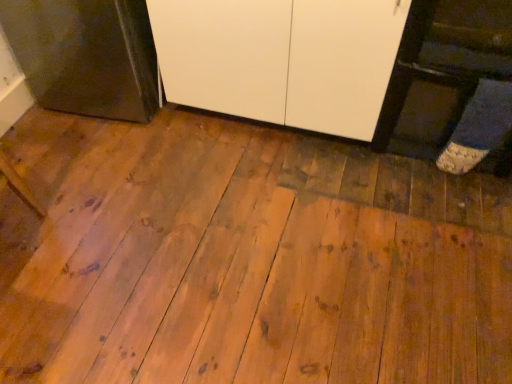
Question: In terms of height, does metallic dark gray oven at left look taller or shorter compared to white matte cabinet at center?

Choices:
 (A) tall
 (B) short

Answer: (B)

Question: From the image's perspective, is metallic dark gray oven at left positioned above or below white matte cabinet at center?

Choices:
 (A) above
 (B) below

Answer: (A)

Question: Is metallic dark gray oven at left bigger or smaller than white matte cabinet at center?

Choices:
 (A) big
 (B) small

Answer: (B)

Question: From a real-world perspective, is white matte cabinet at center positioned above or below metallic dark gray oven at left?

Choices:
 (A) above
 (B) below

Answer: (A)

Question: In terms of width, does white matte cabinet at center look wider or thinner when compared to metallic dark gray oven at left?

Choices:
 (A) thin
 (B) wide

Answer: (B)

Question: From the image's perspective, is white matte cabinet at center located above or below metallic dark gray oven at left?

Choices:
 (A) below
 (B) above

Answer: (A)

Question: Does point (206, 104) appear closer or farther from the camera than point (62, 97)?

Choices:
 (A) closer
 (B) farther

Answer: (A)